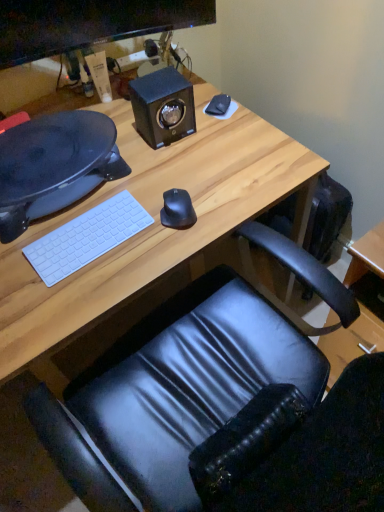
Image resolution: width=384 pixels, height=512 pixels. What are the coordinates of `vacant area that lies between black matte mouse at center and white matte keyboard at lower left` in the screenshot? It's located at (133, 237).